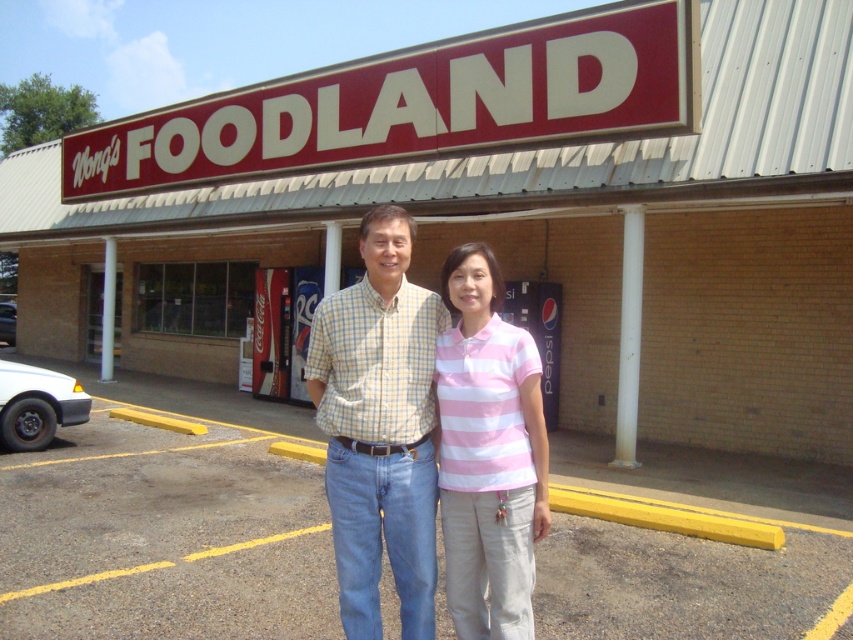
You are standing in front of the building and want to find the red plastic sign at upper center. Based on the coordinates provided, where should you look relative to the entrance?

The red plastic sign at upper center is located at point (415, 106), which means it is positioned above the entrance since the y coordinate is 0.488, indicating it is mounted above the entrance.

From the picture: You are standing in front of the building with the red sign. There is a point marked at coordinates (415, 106). What does this point indicate?

The point at coordinates (415, 106) indicates the location of the red plastic sign at upper center.